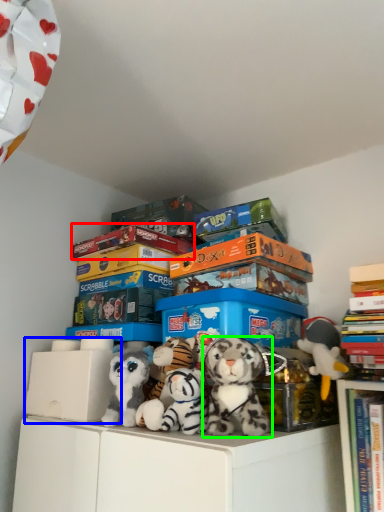
Question: Considering the real-world distances, which object is farthest from book (highlighted by a red box)? storage box (highlighted by a blue box) or toy (highlighted by a green box)?

Choices:
 (A) storage box
 (B) toy

Answer: (B)